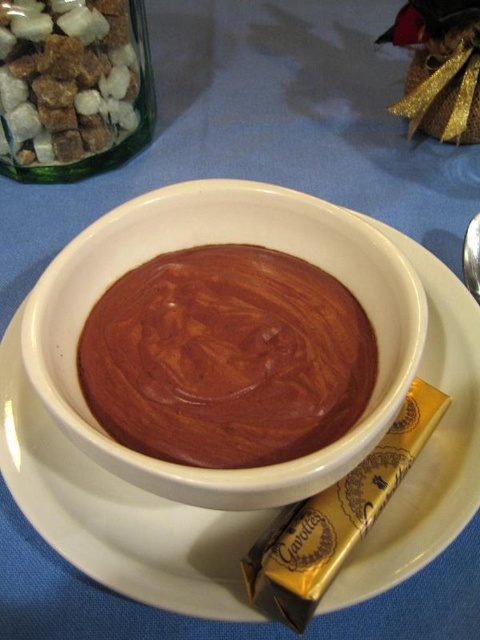
You are a chef trying to place a green glass jar filled with sugar cubes to the left of the smooth chocolate at center. Based on the coordinates provided, is the jar already positioned correctly?

The smooth chocolate at center is located at point (227, 356). Since the jar is to the left of it, the jar is already positioned correctly according to the coordinates provided.

You are a dessert lover who wants to grab both the smooth chocolate at center and the gold foil chocolate bar at center. Can you reach both items without moving your hand? The maximum reach of your hand is 3 inches.

The smooth chocolate at center and gold foil chocolate bar at center are 3.43 inches apart from each other. Since your hand can only reach 3 inches, you cannot reach both items without moving your hand.

You are a food stylist who needs to arrange the smooth chocolate at center and the gold foil chocolate bar at center on a shelf. The shelf has a height limit of 10 cm. Can both items be placed on the shelf without exceeding the height limit?

The smooth chocolate at center has a greater height compared to gold foil chocolate bar at center. However, since the exact heights are not provided, it is impossible to determine if both items can fit within the 10 cm height limit. Additional measurements are needed.